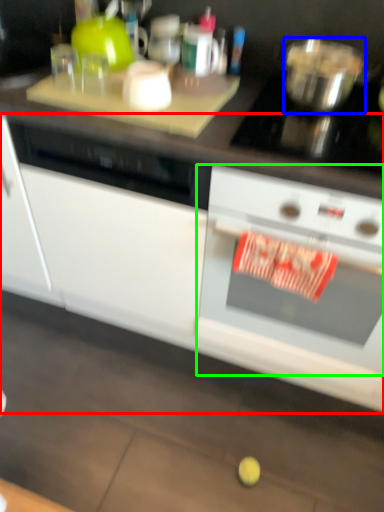
Question: Estimate the real-world distances between objects in this image. Which object is farther from cabinetry (highlighted by a red box), bowl (highlighted by a blue box) or kitchen appliance (highlighted by a green box)?

Choices:
 (A) bowl
 (B) kitchen appliance

Answer: (A)